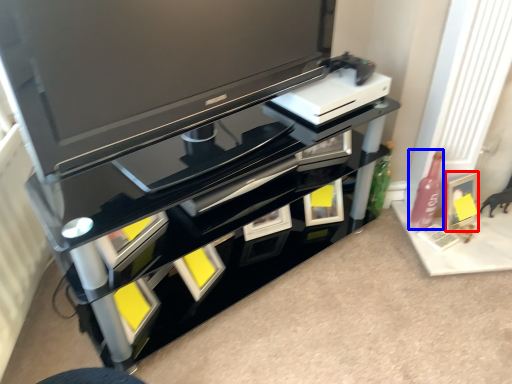
Question: Which point is further to the camera, picture frame (highlighted by a red box) or bottle (highlighted by a blue box)?

Choices:
 (A) picture frame
 (B) bottle

Answer: (A)